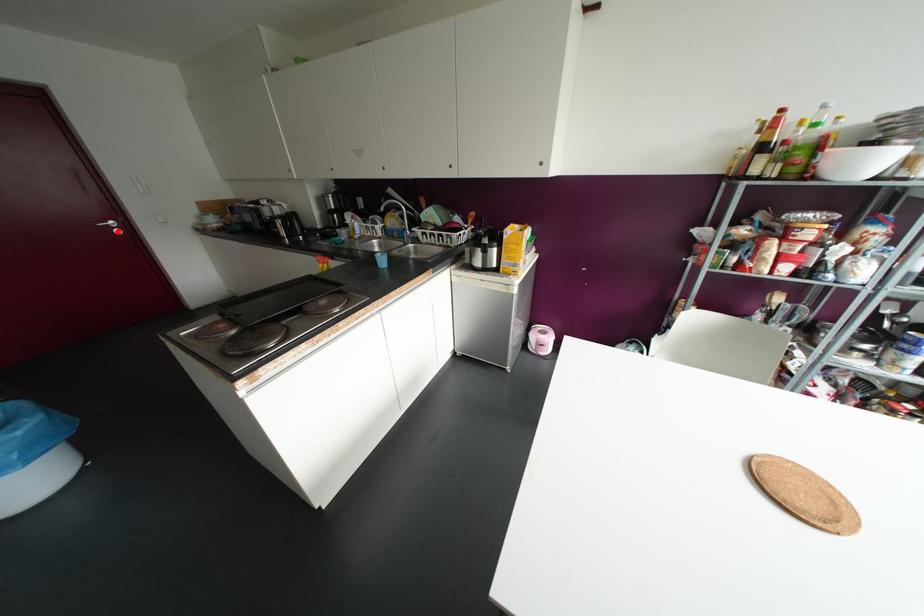
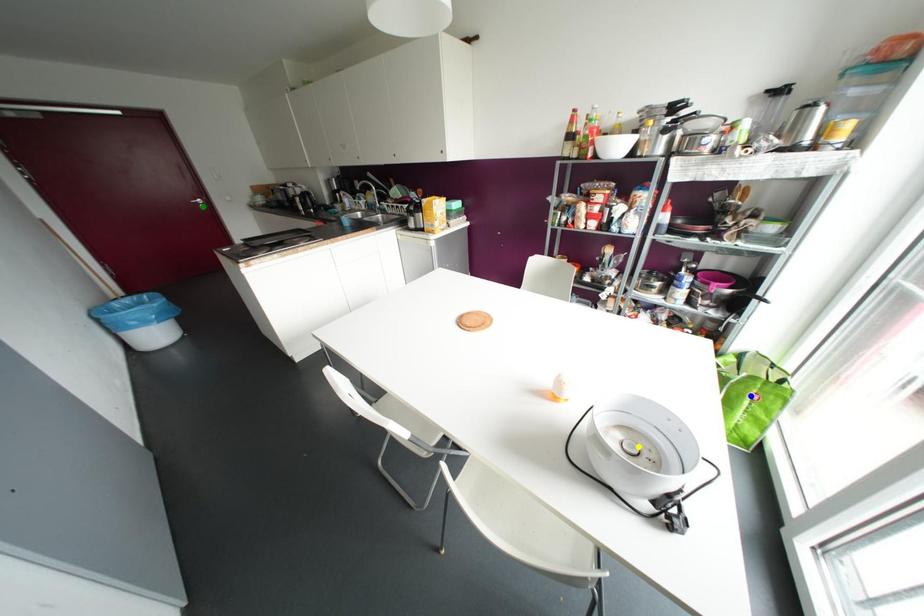
Question: I am providing you with two images of the same scene from different viewpoints. A red point is marked on the first image. You are given multiple points on the second image. Can you choose the point in image 2 that corresponds to the point in image 1?

Choices:
 (A) yellow point
 (B) green point
 (C) blue point

Answer: (B)